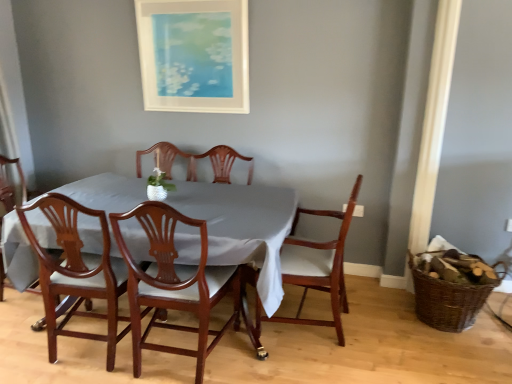
The height and width of the screenshot is (384, 512). Find the location of `mahogany wood chair at lower left, the 2th chair viewed from the left`. mahogany wood chair at lower left, the 2th chair viewed from the left is located at coordinates (77, 272).

Locate an element on the screen. The image size is (512, 384). mahogany wood chair at lower left, which is the first chair from left to right is located at coordinates (18, 173).

Where is `matte white picture frame at upper center`? The width and height of the screenshot is (512, 384). matte white picture frame at upper center is located at coordinates (194, 55).

I want to click on mahogany wood chair at lower left, positioned as the 3th chair in right-to-left order, so click(77, 272).

Considering the positions of objects mahogany wood chair at center, the 2th chair positioned from the right, and mahogany wood chair at center, which is the fourth chair in left-to-right order, in the image provided, who is in front, mahogany wood chair at center, the 2th chair positioned from the right, or mahogany wood chair at center, which is the fourth chair in left-to-right order,?

mahogany wood chair at center, the 2th chair positioned from the right, is closer to the camera.

Is mahogany wood chair at center, the 2th chair positioned from the right, oriented towards mahogany wood chair at center, which is the fourth chair in left-to-right order?

No, mahogany wood chair at center, the 2th chair positioned from the right, is not aimed at mahogany wood chair at center, which is the fourth chair in left-to-right order.

From the image's perspective, would you say mahogany wood chair at center, the 2th chair positioned from the right, is positioned over mahogany wood chair at center, the 1th chair positioned from the right?

Incorrect, from the image's perspective, mahogany wood chair at center, the 2th chair positioned from the right, is lower than mahogany wood chair at center, the 1th chair positioned from the right.

Is mahogany wood chair at lower left, positioned as the 3th chair in right-to-left order, to the right of matte white picture frame at upper center from the viewer's perspective?

Incorrect, mahogany wood chair at lower left, positioned as the 3th chair in right-to-left order, is not on the right side of matte white picture frame at upper center.

Is mahogany wood chair at lower left, positioned as the 3th chair in right-to-left order, oriented away from matte white picture frame at upper center?

No, mahogany wood chair at lower left, positioned as the 3th chair in right-to-left order, is not facing the opposite direction of matte white picture frame at upper center.

Does point (48, 251) appear closer or farther from the camera than point (182, 50)?

Point (48, 251) is positioned closer to the camera compared to point (182, 50).

Is mahogany wood chair at lower left, the 2th chair viewed from the left, thinner than matte white picture frame at upper center?

No, mahogany wood chair at lower left, the 2th chair viewed from the left, is not thinner than matte white picture frame at upper center.

Considering the relative sizes of mahogany wood chair at lower left, which is the 4th chair in right-to-left order, and mahogany wood chair at center, the 1th chair positioned from the right, in the image provided, is mahogany wood chair at lower left, which is the 4th chair in right-to-left order, shorter than mahogany wood chair at center, the 1th chair positioned from the right,?

No, mahogany wood chair at lower left, which is the 4th chair in right-to-left order, is not shorter than mahogany wood chair at center, the 1th chair positioned from the right.

Is mahogany wood chair at lower left, which is the 4th chair in right-to-left order, positioned with its back to mahogany wood chair at center, which is the fourth chair in left-to-right order?

No, mahogany wood chair at center, which is the fourth chair in left-to-right order, is not at the back of mahogany wood chair at lower left, which is the 4th chair in right-to-left order.

Is mahogany wood chair at lower left, which is the 4th chair in right-to-left order, in front of or behind mahogany wood chair at center, the 1th chair positioned from the right, in the image?

Clearly, mahogany wood chair at lower left, which is the 4th chair in right-to-left order, is behind mahogany wood chair at center, the 1th chair positioned from the right.

I want to click on chair that is the 3rd one when counting upward from the brown woven basket at right (from the image's perspective), so click(314, 269).

Is point (418, 283) farther from viewer compared to point (343, 229)?

Yes, it is behind point (343, 229).

Considering the sizes of objects matte white picture frame at upper center and mahogany wood chair at lower left, which is the first chair from left to right, in the image provided, who is taller, matte white picture frame at upper center or mahogany wood chair at lower left, which is the first chair from left to right,?

Standing taller between the two is mahogany wood chair at lower left, which is the first chair from left to right.

Is matte white picture frame at upper center aimed at mahogany wood chair at lower left, which is the 4th chair in right-to-left order?

No.

Can you tell me how much matte white picture frame at upper center and mahogany wood chair at lower left, which is the first chair from left to right, differ in facing direction?

The facing directions of matte white picture frame at upper center and mahogany wood chair at lower left, which is the first chair from left to right, are 88.8 degrees apart.

Is matte white picture frame at upper center wider than mahogany wood chair at lower left, which is the 4th chair in right-to-left order?

In fact, matte white picture frame at upper center might be narrower than mahogany wood chair at lower left, which is the 4th chair in right-to-left order.

Between matte white picture frame at upper center and mahogany wood chair at center, the 2th chair positioned from the right, which one has smaller width?

Thinner between the two is matte white picture frame at upper center.

From a real-world perspective, is matte white picture frame at upper center positioned under mahogany wood chair at center, the 2th chair positioned from the right, based on gravity?

No.

Considering the positions of objects matte white picture frame at upper center and mahogany wood chair at center, which ranks as the 3th chair in left-to-right order, in the image provided, who is more to the right, matte white picture frame at upper center or mahogany wood chair at center, which ranks as the 3th chair in left-to-right order,?

Positioned to the right is mahogany wood chair at center, which ranks as the 3th chair in left-to-right order.

Does point (159, 11) come behind point (139, 307)?

Yes, point (159, 11) is farther from viewer.

Based on the photo, is mahogany wood chair at center, which is the fourth chair in left-to-right order, oriented towards mahogany wood chair at lower left, which is the 4th chair in right-to-left order?

Yes, mahogany wood chair at center, which is the fourth chair in left-to-right order, is turned towards mahogany wood chair at lower left, which is the 4th chair in right-to-left order.

Considering the relative sizes of mahogany wood chair at center, the 1th chair positioned from the right, and mahogany wood chair at lower left, which is the first chair from left to right, in the image provided, is mahogany wood chair at center, the 1th chair positioned from the right, bigger than mahogany wood chair at lower left, which is the first chair from left to right,?

Incorrect, mahogany wood chair at center, the 1th chair positioned from the right, is not larger than mahogany wood chair at lower left, which is the first chair from left to right.

Which is more to the right, mahogany wood chair at center, the 1th chair positioned from the right, or mahogany wood chair at lower left, which is the 4th chair in right-to-left order?

mahogany wood chair at center, the 1th chair positioned from the right, is more to the right.

In the scene shown: Considering the sizes of mahogany wood chair at center, which is the fourth chair in left-to-right order, and mahogany wood chair at lower left, which is the first chair from left to right, in the image, is mahogany wood chair at center, which is the fourth chair in left-to-right order, taller or shorter than mahogany wood chair at lower left, which is the first chair from left to right,?

Considering their sizes, mahogany wood chair at center, which is the fourth chair in left-to-right order, has less height than mahogany wood chair at lower left, which is the first chair from left to right.

The image size is (512, 384). I want to click on the 2nd chair above when counting from the mahogany wood chair at center, the 2th chair positioned from the right (from the image's perspective), so click(x=314, y=269).

Where is `picture frame lying on the right of mahogany wood chair at lower left, positioned as the 3th chair in right-to-left order`? The height and width of the screenshot is (384, 512). picture frame lying on the right of mahogany wood chair at lower left, positioned as the 3th chair in right-to-left order is located at coordinates (194, 55).

Based on their spatial positions, is mahogany wood chair at center, which is the fourth chair in left-to-right order, or mahogany wood chair at lower left, which is the first chair from left to right, closer to brown woven basket at right?

mahogany wood chair at center, which is the fourth chair in left-to-right order.

Which object lies nearer to the anchor point matte white picture frame at upper center, mahogany wood chair at center, which ranks as the 3th chair in left-to-right order, or mahogany wood chair at lower left, which is the 4th chair in right-to-left order?

mahogany wood chair at center, which ranks as the 3th chair in left-to-right order, lies closer to matte white picture frame at upper center than the other object.

Considering their positions, is mahogany wood chair at lower left, which is the 4th chair in right-to-left order, positioned further to matte white picture frame at upper center than mahogany wood chair at center, which is the fourth chair in left-to-right order?

mahogany wood chair at lower left, which is the 4th chair in right-to-left order, is further to matte white picture frame at upper center.

Which object lies nearer to the anchor point matte white picture frame at upper center, mahogany wood chair at lower left, which is the 4th chair in right-to-left order, or mahogany wood chair at center, which ranks as the 3th chair in left-to-right order?

mahogany wood chair at center, which ranks as the 3th chair in left-to-right order, lies closer to matte white picture frame at upper center than the other object.

Based on their spatial positions, is mahogany wood chair at lower left, which is the 4th chair in right-to-left order, or matte white picture frame at upper center further from brown woven basket at right?

mahogany wood chair at lower left, which is the 4th chair in right-to-left order.

Which object lies nearer to the anchor point mahogany wood chair at lower left, positioned as the 3th chair in right-to-left order, mahogany wood chair at lower left, which is the 4th chair in right-to-left order, or mahogany wood chair at center, the 1th chair positioned from the right?

mahogany wood chair at center, the 1th chair positioned from the right, lies closer to mahogany wood chair at lower left, positioned as the 3th chair in right-to-left order, than the other object.

From the image, which object appears to be farther from mahogany wood chair at lower left, the 2th chair viewed from the left, mahogany wood chair at lower left, which is the first chair from left to right, or mahogany table at center?

mahogany wood chair at lower left, which is the first chair from left to right, lies further to mahogany wood chair at lower left, the 2th chair viewed from the left, than the other object.

Looking at the image, which one is located closer to brown woven basket at right, matte white picture frame at upper center or mahogany wood chair at lower left, positioned as the 3th chair in right-to-left order?

mahogany wood chair at lower left, positioned as the 3th chair in right-to-left order, lies closer to brown woven basket at right than the other object.

Find the location of a particular element. The width and height of the screenshot is (512, 384). kitchen & dining room table between mahogany wood chair at lower left, which is the first chair from left to right, and mahogany wood chair at center, the 1th chair positioned from the right, from left to right is located at coordinates (242, 227).

What are the coordinates of `picture frame between mahogany table at center and brown woven basket at right from left to right` in the screenshot? It's located at (194, 55).

What are the coordinates of `picture frame between mahogany wood chair at lower left, the 2th chair viewed from the left, and brown woven basket at right` in the screenshot? It's located at (194, 55).

You are a GUI agent. You are given a task and a screenshot of the screen. Output one action in this format:
    pyautogui.click(x=<x>, y=<y>)
    Task: Click on the kitchen & dining room table that lies between matte white picture frame at upper center and mahogany wood chair at lower left, positioned as the 3th chair in right-to-left order, from top to bottom
    The height and width of the screenshot is (384, 512).
    Given the screenshot: What is the action you would take?
    pyautogui.click(x=242, y=227)